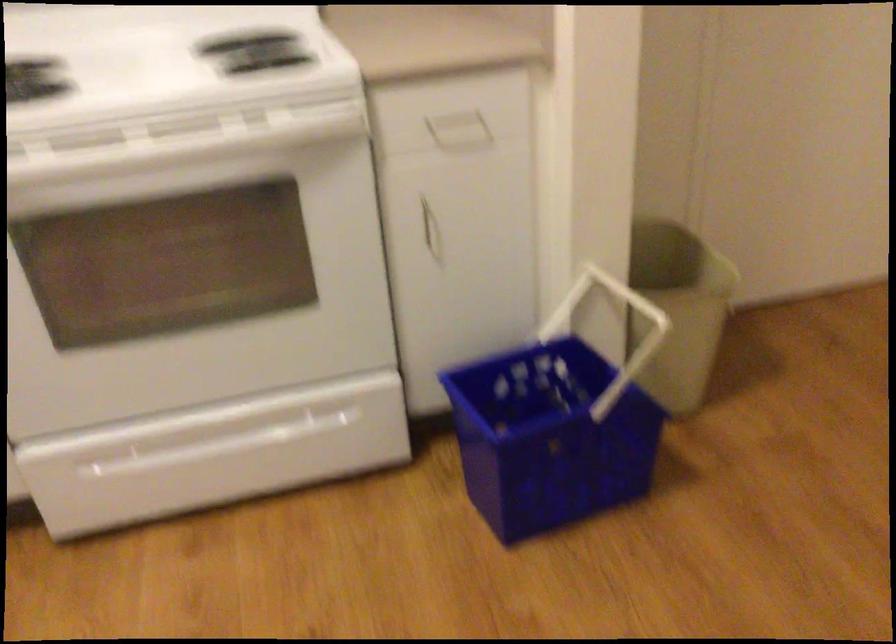
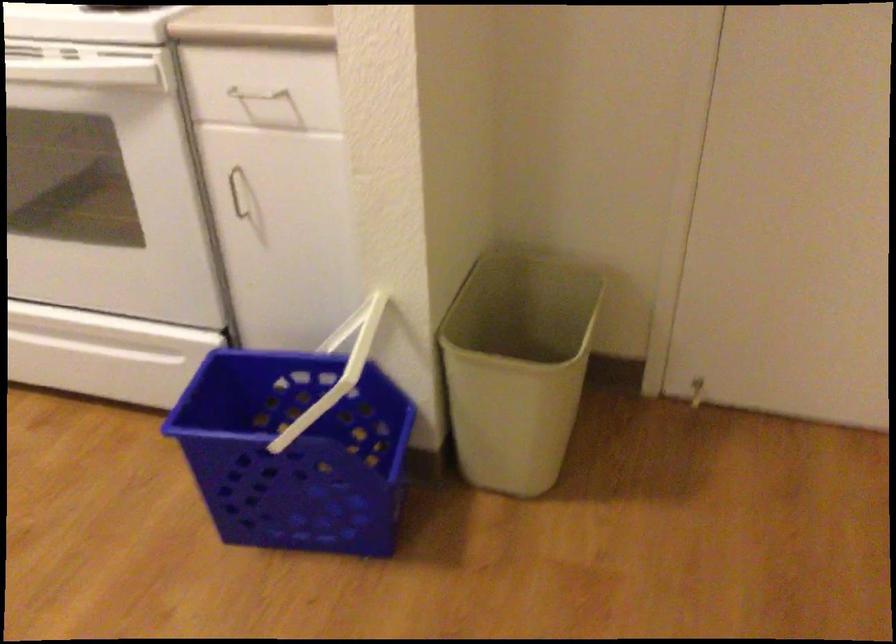
In the second image, find the point that corresponds to [436,114] in the first image.

(253, 98)